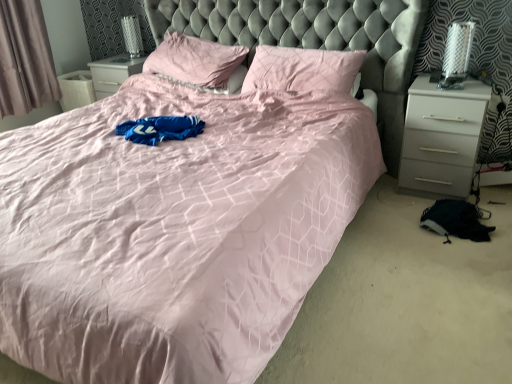
Question: From a real-world perspective, is white glossy nightstand at right located beneath gray fabric curtain at left?

Choices:
 (A) yes
 (B) no

Answer: (A)

Question: Is white glossy nightstand at right closer to camera compared to gray fabric curtain at left?

Choices:
 (A) yes
 (B) no

Answer: (A)

Question: Is white glossy nightstand at right further to the viewer compared to gray fabric curtain at left?

Choices:
 (A) yes
 (B) no

Answer: (B)

Question: Is white glossy nightstand at right facing towards gray fabric curtain at left?

Choices:
 (A) no
 (B) yes

Answer: (A)

Question: Can you confirm if white glossy nightstand at right is positioned to the right of gray fabric curtain at left?

Choices:
 (A) no
 (B) yes

Answer: (B)

Question: Is the surface of white glossy nightstand at right in direct contact with gray fabric curtain at left?

Choices:
 (A) no
 (B) yes

Answer: (A)

Question: Is gray fabric curtain at left in front of white glossy nightstand at right?

Choices:
 (A) yes
 (B) no

Answer: (B)

Question: Is gray fabric curtain at left facing towards white glossy nightstand at right?

Choices:
 (A) yes
 (B) no

Answer: (A)

Question: From the image's perspective, is gray fabric curtain at left below white glossy nightstand at right?

Choices:
 (A) yes
 (B) no

Answer: (B)

Question: Does gray fabric curtain at left appear on the right side of white glossy nightstand at right?

Choices:
 (A) no
 (B) yes

Answer: (A)

Question: Does gray fabric curtain at left have a greater width compared to white glossy nightstand at right?

Choices:
 (A) no
 (B) yes

Answer: (A)

Question: Is gray fabric curtain at left placed right next to white glossy nightstand at right?

Choices:
 (A) no
 (B) yes

Answer: (A)

Question: Can you confirm if gray fabric curtain at left is bigger than pink fabric pillow at center, which is the 1th pillow from left to right?

Choices:
 (A) yes
 (B) no

Answer: (B)